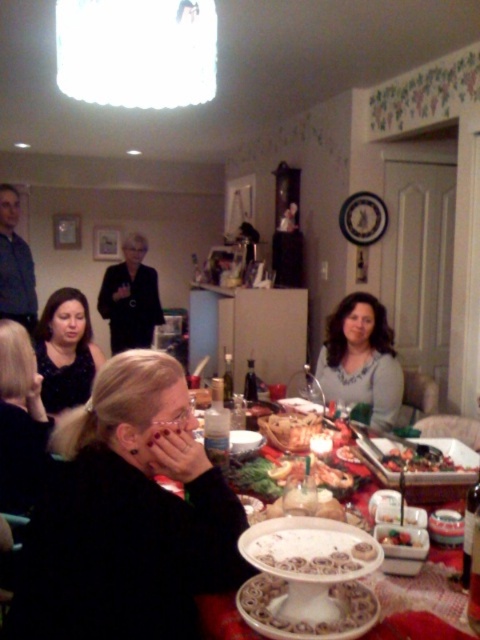
Is blonde hair at lower left positioned before black matte blazer at center?

Yes.

In order to click on blonde hair at lower left in this screenshot , I will do `click(21, 420)`.

Who is taller, matte black dress at lower left or shiny red plate at center?

A: Standing taller between the two is matte black dress at lower left.

Can you confirm if matte black dress at lower left is thinner than shiny red plate at center?

No.

Image resolution: width=480 pixels, height=640 pixels. Find the location of `matte black dress at lower left`. matte black dress at lower left is located at coordinates (66, 349).

Is black matte jacket at lower left bigger than smooth white cake at center?

Yes, black matte jacket at lower left is bigger than smooth white cake at center.

Is black matte jacket at lower left taller than smooth white cake at center?

Correct, black matte jacket at lower left is much taller as smooth white cake at center.

Is point (201, 576) closer to camera compared to point (394, 541)?

Yes, point (201, 576) is in front of point (394, 541).

I want to click on black matte jacket at lower left, so click(128, 515).